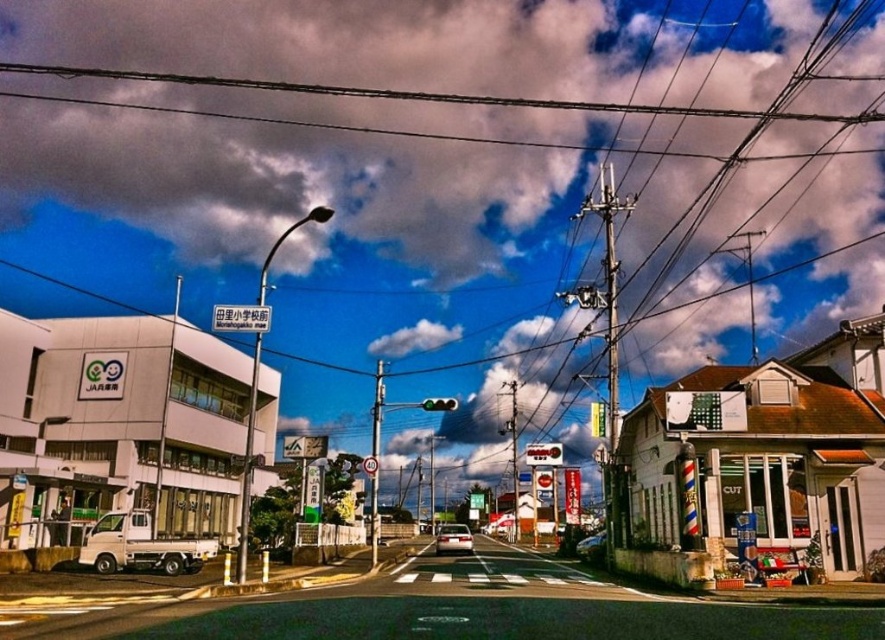
Question: Which point appears farthest from the camera in this image?

Choices:
 (A) (175, 323)
 (B) (468, 544)
 (C) (775, 116)
 (D) (601, 547)

Answer: (C)

Question: Can you confirm if metallic pole at left is bigger than green glass traffic light at center?

Choices:
 (A) no
 (B) yes

Answer: (B)

Question: Is silver metallic car at center further to the viewer compared to blue metallic car at center?

Choices:
 (A) yes
 (B) no

Answer: (A)

Question: Is metallic wire at upper center smaller than silver metallic car at center?

Choices:
 (A) no
 (B) yes

Answer: (A)

Question: Which point is closer to the camera taking this photo?

Choices:
 (A) (468, 536)
 (B) (576, 108)

Answer: (A)

Question: Which of the following is the farthest from the observer?

Choices:
 (A) green glass traffic light at center
 (B) silver metallic car at center
 (C) metallic wire at upper center

Answer: (C)